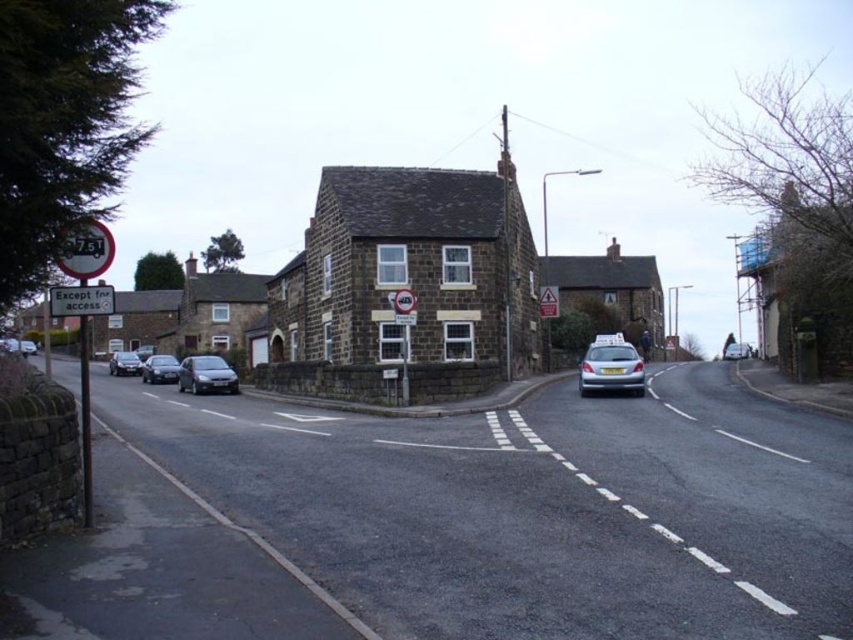
Question: Among these points, which one is farthest from the camera?

Choices:
 (A) (146, 369)
 (B) (134, 356)

Answer: (B)

Question: Considering the relative positions of metallic triangular warning sign at center and silver metallic car at right in the image provided, where is metallic triangular warning sign at center located with respect to silver metallic car at right?

Choices:
 (A) right
 (B) left

Answer: (B)

Question: Which point is farther to the camera?

Choices:
 (A) white plastic sign at upper left
 (B) satin black sedan at lower left
 (C) metallic triangular warning sign at center
 (D) shiny black sedan at center-left

Answer: (D)

Question: Which of the following is the closest to the observer?

Choices:
 (A) satin black sedan at lower left
 (B) shiny black sedan at center-left
 (C) metallic triangular warning sign at center

Answer: (A)

Question: Is white plastic sign at upper left further to camera compared to matte black car at left?

Choices:
 (A) no
 (B) yes

Answer: (A)

Question: Does metallic circular sign at left appear under satin black sedan at lower left?

Choices:
 (A) no
 (B) yes

Answer: (A)